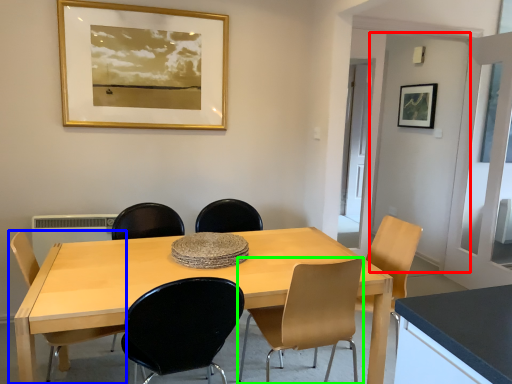
Question: Which object is the closest to the door (highlighted by a red box)? Choose among these: chair (highlighted by a blue box) or chair (highlighted by a green box).

Choices:
 (A) chair
 (B) chair

Answer: (B)